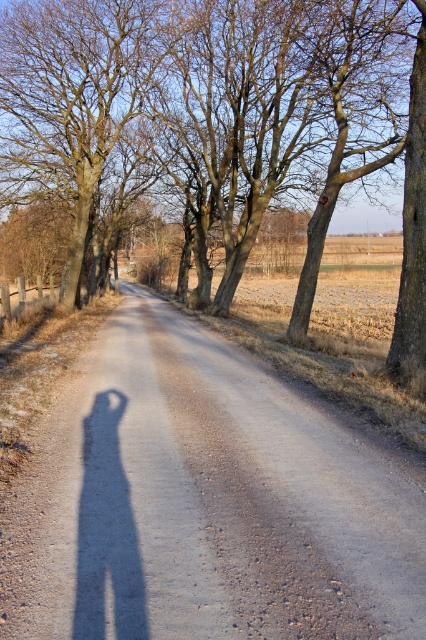
You are standing on the dirt road looking towards the horizon. There are two points marked on the road, one at coordinates point (x=120, y=605) and the other at point (x=106, y=76). Which point is closer to you?

Point (x=120, y=605) is closer to the camera than point (x=106, y=76), so the point at coordinates point (x=120, y=605) is closer to you.

You are standing on the dirt road and looking towards the horizon. Which tree, the brown bark tree at center or the brown rough tree at upper left, is closer to you?

The brown bark tree at center is closer to you because it is located below the brown rough tree at upper left in the image, indicating it is positioned in the foreground.

You are standing at the edge of the dirt road at center and looking towards the brown rough tree at upper left. Which object is taller?

The brown rough tree at upper left is taller than the dirt road at center.